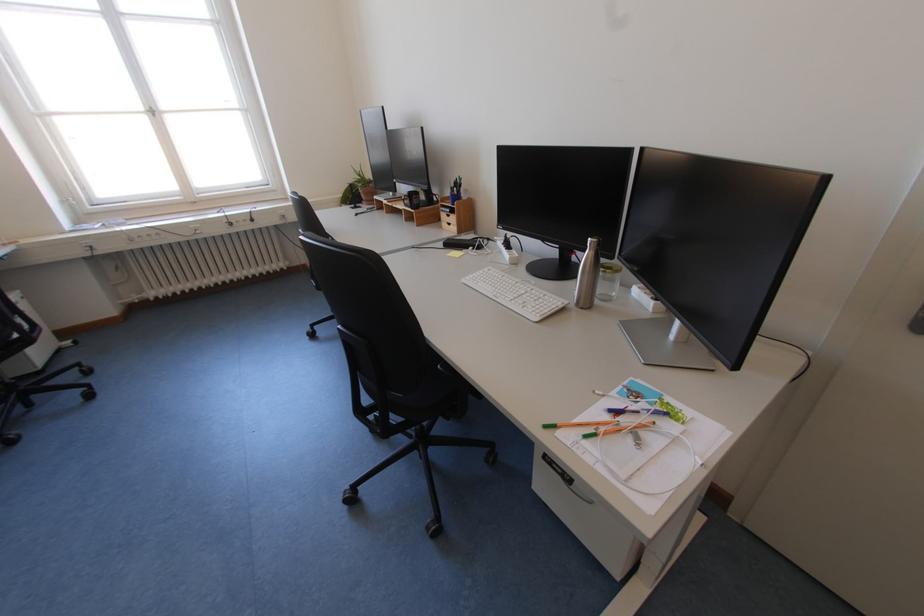
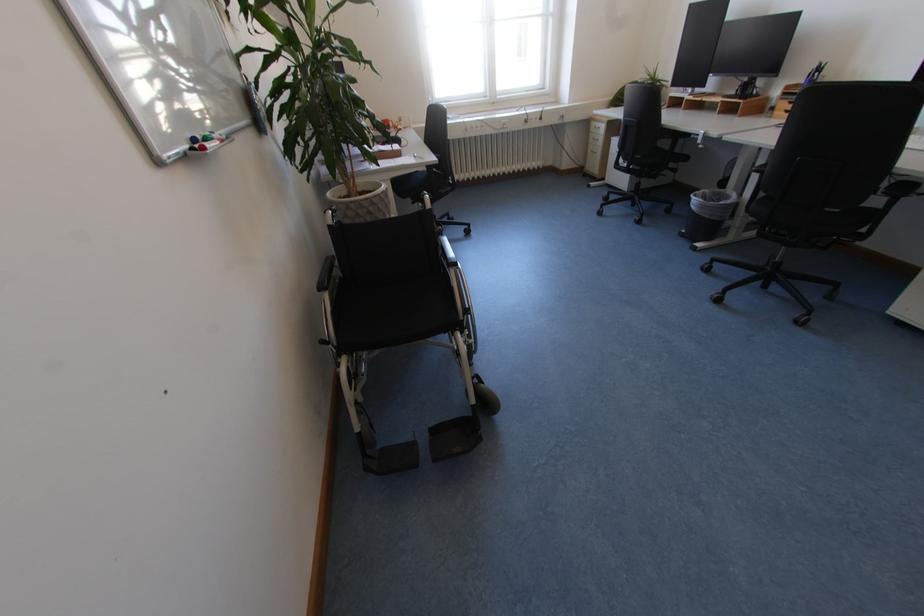
In a continuous first-person perspective shot, in which direction is the camera moving?

The cameraman walked toward left, backward.